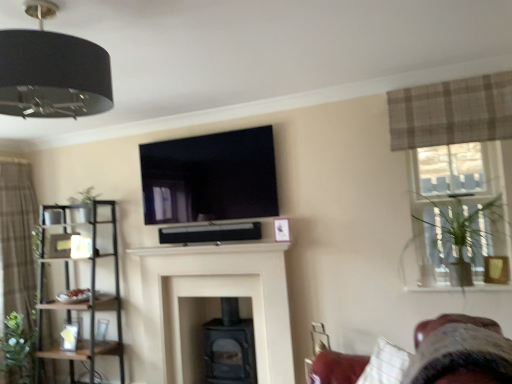
Question: Does black glossy tv at upper center have a lesser height compared to brown textured curtain at left, the first curtain ordered from the bottom?

Choices:
 (A) yes
 (B) no

Answer: (A)

Question: Is black glossy tv at upper center facing away from brown textured curtain at left, which appears as the 2th curtain when viewed from the front?

Choices:
 (A) no
 (B) yes

Answer: (A)

Question: From a real-world perspective, is black glossy tv at upper center located beneath brown textured curtain at left, the 1th curtain positioned from the left?

Choices:
 (A) yes
 (B) no

Answer: (B)

Question: From the image's perspective, is black glossy tv at upper center beneath brown textured curtain at left, which appears as the 2th curtain when viewed from the front?

Choices:
 (A) no
 (B) yes

Answer: (A)

Question: From the image's perspective, does black glossy tv at upper center appear higher than brown textured curtain at left, which appears as the 2th curtain when viewed from the front?

Choices:
 (A) no
 (B) yes

Answer: (B)

Question: Is plush fabric swivel chair at lower right to the left or to the right of green leafy plant at left, the 1th plant when ordered from left to right, in the image?

Choices:
 (A) left
 (B) right

Answer: (B)

Question: From a real-world perspective, is plush fabric swivel chair at lower right physically located above or below green leafy plant at left, marked as the first plant in a bottom-to-top arrangement?

Choices:
 (A) above
 (B) below

Answer: (A)

Question: Is plush fabric swivel chair at lower right spatially inside green leafy plant at left, the 1th plant when ordered from left to right, or outside of it?

Choices:
 (A) inside
 (B) outside

Answer: (B)

Question: Based on their sizes in the image, would you say plush fabric swivel chair at lower right is bigger or smaller than green leafy plant at left, which is counted as the 2th plant, starting from the right?

Choices:
 (A) big
 (B) small

Answer: (A)

Question: In terms of width, does black glossy tv at upper center look wider or thinner when compared to black fabric lampshade at upper left?

Choices:
 (A) wide
 (B) thin

Answer: (B)

Question: From the image's perspective, is black glossy tv at upper center positioned above or below black fabric lampshade at upper left?

Choices:
 (A) above
 (B) below

Answer: (B)

Question: Looking at the image, does black glossy tv at upper center seem bigger or smaller compared to black fabric lampshade at upper left?

Choices:
 (A) big
 (B) small

Answer: (B)

Question: Would you say black glossy tv at upper center is inside or outside black fabric lampshade at upper left?

Choices:
 (A) outside
 (B) inside

Answer: (A)

Question: Is brown textured curtain at left, the first curtain ordered from the bottom, wider or thinner than clear glass window at upper right?

Choices:
 (A) wide
 (B) thin

Answer: (A)

Question: Considering their positions, is brown textured curtain at left, the second curtain positioned from the right, located in front of or behind clear glass window at upper right?

Choices:
 (A) front
 (B) behind

Answer: (B)